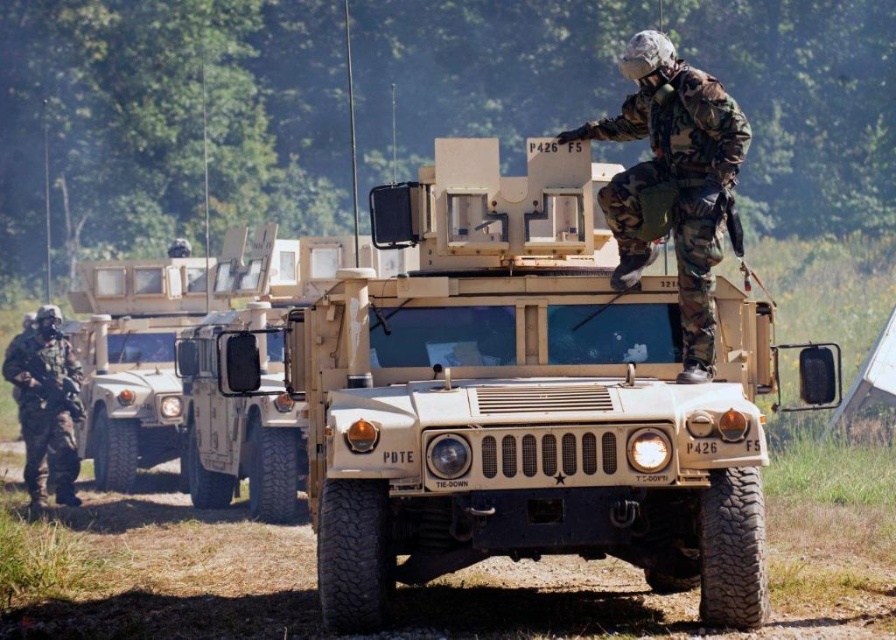
Is camouflage fabric soldier at center bigger than camouflage fabric uniform at left?

Indeed, camouflage fabric soldier at center has a larger size compared to camouflage fabric uniform at left.

In the scene shown: Which is above, camouflage fabric soldier at center or camouflage fabric uniform at left?

camouflage fabric soldier at center is higher up.

Who is more forward, (608, 193) or (30, 486)?

Point (608, 193)

The height and width of the screenshot is (640, 896). In order to click on camouflage fabric soldier at center in this screenshot , I will do `click(673, 180)`.